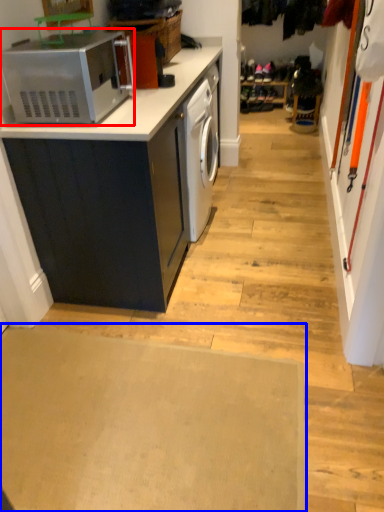
Question: Which point is closer to the camera, home appliance (highlighted by a red box) or plain (highlighted by a blue box)?

Choices:
 (A) home appliance
 (B) plain

Answer: (B)